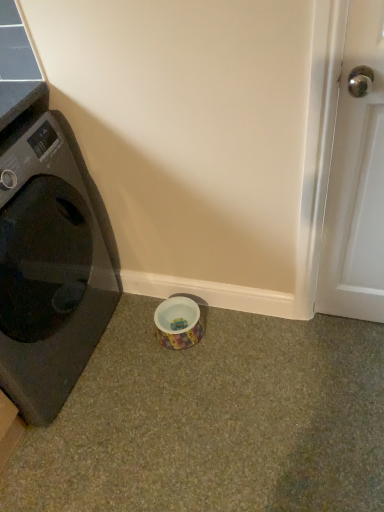
At what (x,y) coordinates should I click in order to perform the action: click on vacant space in front of white glossy door handle at right. Please return your answer as a coordinate pair (x, y). Image resolution: width=384 pixels, height=512 pixels. Looking at the image, I should click on (353, 357).